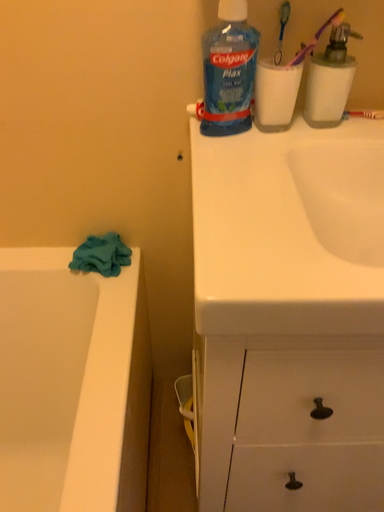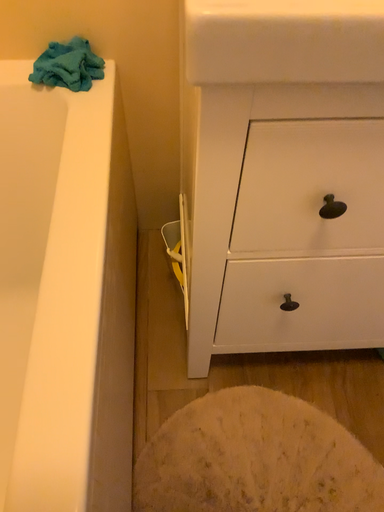
Question: How did the camera likely rotate when shooting the video?

Choices:
 (A) rotated upward
 (B) rotated downward

Answer: (B)